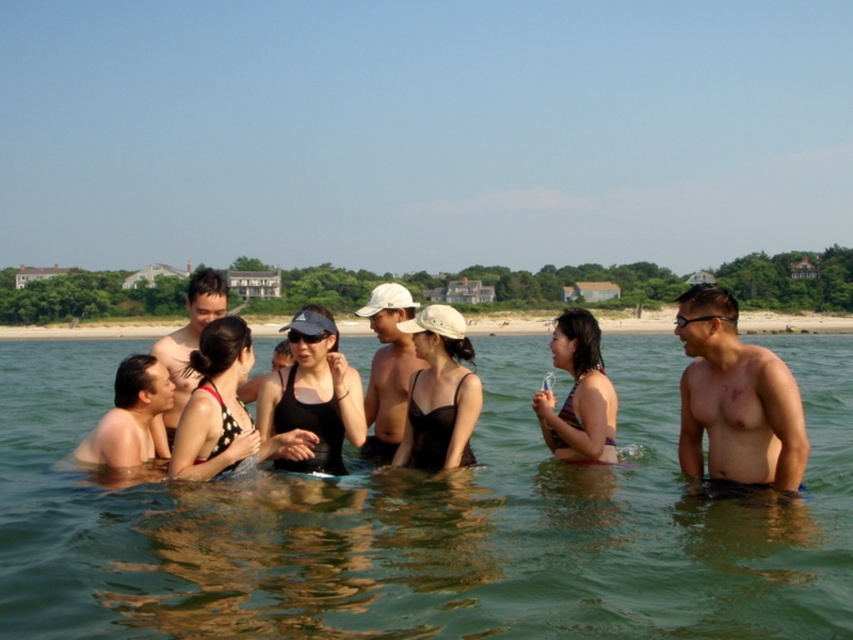
From the picture: Is black matte swimsuit at center thinner than black swimsuit at center?

No.

Is point (323, 337) positioned behind point (218, 353)?

Yes, it is.

Where is `black matte swimsuit at center`? black matte swimsuit at center is located at coordinates (312, 396).

Is black swimsuit at center positioned before purple bikini at center?

Yes, black swimsuit at center is in front of purple bikini at center.

What do you see at coordinates (215, 404) in the screenshot? I see `black swimsuit at center` at bounding box center [215, 404].

Where is `black swimsuit at center`? The height and width of the screenshot is (640, 853). black swimsuit at center is located at coordinates (215, 404).

Which of these two, green water at center or smooth skin man at lower left, stands shorter?

green water at center is shorter.

Does green water at center lie behind smooth skin man at lower left?

No, green water at center is in front of smooth skin man at lower left.

Who is more distant from viewer, (86,627) or (125,445)?

The point (125,445) is more distant.

In order to click on green water at center in this screenshot , I will do `click(427, 522)`.